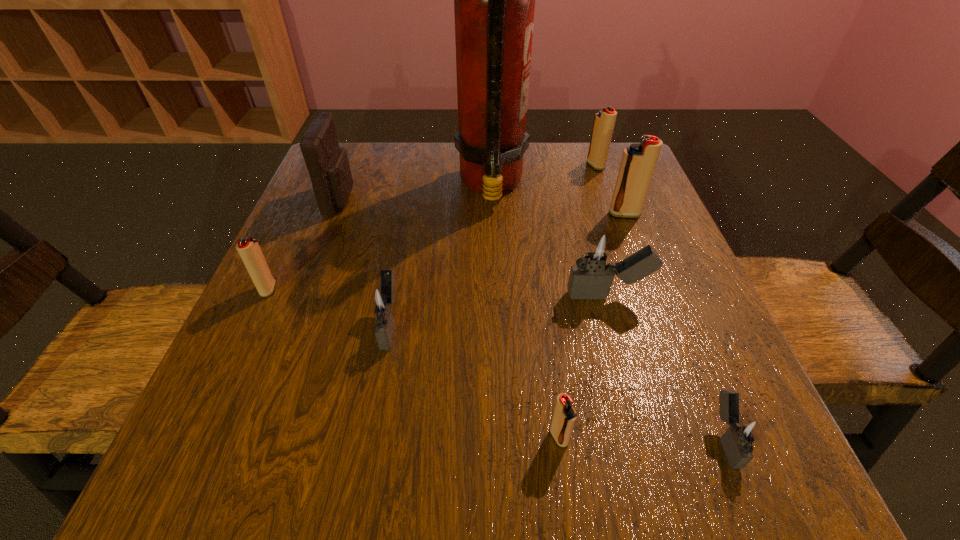
This screenshot has width=960, height=540. In order to click on the leftmost red igniter in this screenshot , I will do `click(249, 250)`.

Locate an element on the screen. This screenshot has width=960, height=540. the second nearest red igniter is located at coordinates (249, 250).

This screenshot has height=540, width=960. I want to click on the fifth igniter from right to left, so click(564, 417).

You are a GUI agent. You are given a task and a screenshot of the screen. Output one action in this format:
    pyautogui.click(x=<x>, y=<y>)
    Task: Click on the nearest red igniter
    This screenshot has width=960, height=540.
    Given the screenshot: What is the action you would take?
    pyautogui.click(x=564, y=417)

The width and height of the screenshot is (960, 540). Find the location of `the nearest gray igniter`. the nearest gray igniter is located at coordinates (746, 433).

You are a GUI agent. You are given a task and a screenshot of the screen. Output one action in this format:
    pyautogui.click(x=<x>, y=<y>)
    Task: Click on the smallest gray igniter
    The height and width of the screenshot is (540, 960).
    Given the screenshot: What is the action you would take?
    pyautogui.click(x=746, y=433)

This screenshot has height=540, width=960. I want to click on vacant region located 0.150m at the nozzle of the fire extinguisher, so click(392, 185).

Where is `free space located 0.310m at the nozzle of the fire extinguisher`? Image resolution: width=960 pixels, height=540 pixels. free space located 0.310m at the nozzle of the fire extinguisher is located at coordinates (324, 185).

Where is `free space located 0.240m at the nozzle of the fire extinguisher`? The image size is (960, 540). free space located 0.240m at the nozzle of the fire extinguisher is located at coordinates (353, 185).

This screenshot has height=540, width=960. What are the coordinates of `vacant area located 0.330m on the left of the second farthest red igniter` in the screenshot? It's located at (456, 214).